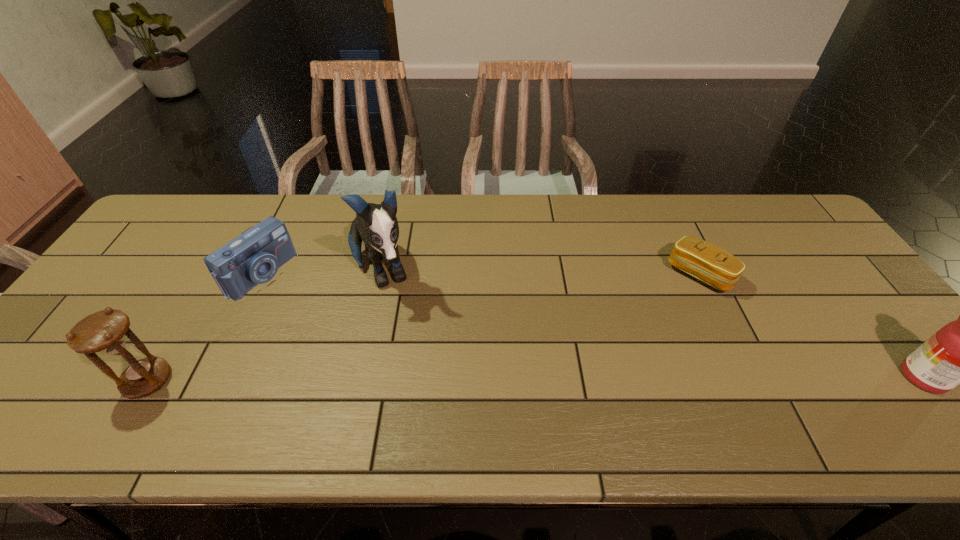
What are the coordinates of `the leftmost object` in the screenshot? It's located at (105, 332).

Identify the location of the third tallest object. This screenshot has width=960, height=540. (105, 332).

Identify the location of the fourth shortest object. (959, 353).

Identify the location of the rightmost object. (959, 353).

Locate an element on the screen. The height and width of the screenshot is (540, 960). the second object from left to right is located at coordinates (252, 258).

Where is `the second shortest object`? The width and height of the screenshot is (960, 540). the second shortest object is located at coordinates (252, 258).

Locate an element on the screen. The width and height of the screenshot is (960, 540). the shortest object is located at coordinates (708, 263).

Where is `clutch bag`? Image resolution: width=960 pixels, height=540 pixels. clutch bag is located at coordinates (708, 263).

I want to click on puppy, so click(376, 224).

Find the location of a particular element. the tallest object is located at coordinates (376, 224).